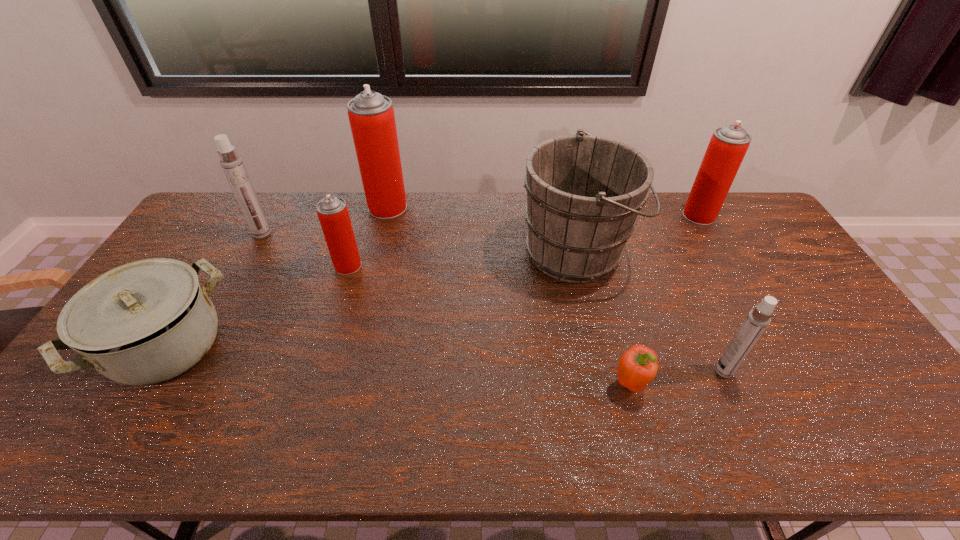
The image size is (960, 540). What are the coordinates of `object that is the sixth closest one to the farther white aerosol can` in the screenshot? It's located at (757, 320).

Point out which aerosol can is positioned as the second nearest to the second nearest aerosol can. Please provide its 2D coordinates. Your answer should be formatted as a tuple, i.e. [(x, y)], where the tuple contains the x and y coordinates of a point satisfying the conditions above.

[(231, 163)]

Identify which aerosol can is the closest to the tallest object. Please provide its 2D coordinates. Your answer should be formatted as a tuple, i.e. [(x, y)], where the tuple contains the x and y coordinates of a point satisfying the conditions above.

[(333, 214)]

Locate an element on the screen. This screenshot has width=960, height=540. red aerosol can that can be found as the closest to the biggest red aerosol can is located at coordinates (333, 214).

Locate which red aerosol can ranks in proximity to the leftmost aerosol can. Please provide its 2D coordinates. Your answer should be formatted as a tuple, i.e. [(x, y)], where the tuple contains the x and y coordinates of a point satisfying the conditions above.

[(333, 214)]

This screenshot has width=960, height=540. In order to click on free point that satisfies the following two spatial constraints: 1. on the front side of the tallest object; 2. on the right side of the shortest object in this screenshot , I will do `click(344, 384)`.

The image size is (960, 540). Find the location of `vacant region that satisfies the following two spatial constraints: 1. on the back side of the second biggest red aerosol can; 2. on the left side of the saucepan`. vacant region that satisfies the following two spatial constraints: 1. on the back side of the second biggest red aerosol can; 2. on the left side of the saucepan is located at coordinates (248, 215).

Locate an element on the screen. free space that satisfies the following two spatial constraints: 1. on the handle side of the seventh object from left to right; 2. on the left side of the bucket is located at coordinates click(x=604, y=371).